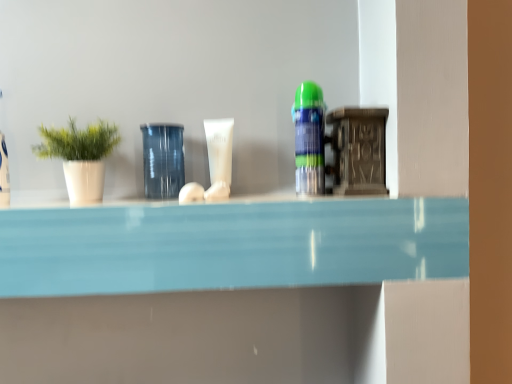
I want to click on white matte tube at center, the 1th toiletry when ordered from left to right, so click(x=219, y=157).

What do you see at coordinates (163, 160) in the screenshot?
I see `transparent glass jar at center` at bounding box center [163, 160].

Find the location of a particular element. white matte tube at center, the first toiletry positioned from the back is located at coordinates (219, 157).

Considering the relative positions of translucent plastic spray can at center, which appears as the first toiletry when viewed from the right, and white matte pot at left in the image provided, is translucent plastic spray can at center, which appears as the first toiletry when viewed from the right, to the left of white matte pot at left from the viewer's perspective?

No, translucent plastic spray can at center, which appears as the first toiletry when viewed from the right, is not to the left of white matte pot at left.

Considering the relative sizes of translucent plastic spray can at center, which appears as the second toiletry when viewed from the left, and white matte pot at left in the image provided, is translucent plastic spray can at center, which appears as the second toiletry when viewed from the left, thinner than white matte pot at left?

Indeed, translucent plastic spray can at center, which appears as the second toiletry when viewed from the left, has a lesser width compared to white matte pot at left.

Starting from the white matte pot at left, which toiletry is the 2nd one to the right? Please provide its 2D coordinates.

[(309, 138)]

Are white matte pot at left and white matte tube at center, arranged as the 2th toiletry when viewed from the front, far apart?

No.

Looking at the image, does white matte pot at left seem bigger or smaller compared to white matte tube at center, the 1th toiletry when ordered from left to right?

Clearly, white matte pot at left is larger in size than white matte tube at center, the 1th toiletry when ordered from left to right.

From the image's perspective, is white matte pot at left located beneath white matte tube at center, arranged as the 2th toiletry when viewed from the right?

Yes, from the image's perspective, white matte pot at left is below white matte tube at center, arranged as the 2th toiletry when viewed from the right.

Consider the image. Measure the distance from white matte pot at left to white matte tube at center, the 1th toiletry when ordered from left to right.

A distance of 8.90 inches exists between white matte pot at left and white matte tube at center, the 1th toiletry when ordered from left to right.

Can white matte pot at left be found inside white matte tube at center, arranged as the 2th toiletry when viewed from the front?

No, white matte pot at left is located outside of white matte tube at center, arranged as the 2th toiletry when viewed from the front.

Based on their positions, is white matte tube at center, arranged as the 2th toiletry when viewed from the front, located to the left or right of white matte pot at left?

Based on their positions, white matte tube at center, arranged as the 2th toiletry when viewed from the front, is located to the right of white matte pot at left.

Between white matte tube at center, arranged as the 2th toiletry when viewed from the right, and white matte pot at left, which one has smaller width?

With smaller width is white matte tube at center, arranged as the 2th toiletry when viewed from the right.

Looking at this image, is white matte tube at center, the 1th toiletry when ordered from left to right, aimed at white matte pot at left?

No, white matte tube at center, the 1th toiletry when ordered from left to right, is not aimed at white matte pot at left.

In the scene shown: Can we say white matte tube at center, arranged as the 2th toiletry when viewed from the front, lies outside transparent glass jar at center?

That's correct, white matte tube at center, arranged as the 2th toiletry when viewed from the front, is outside of transparent glass jar at center.

Is white matte tube at center, arranged as the 2th toiletry when viewed from the right, oriented away from transparent glass jar at center?

No.

Locate an element on the screen. Image resolution: width=512 pixels, height=384 pixels. glass vase to the left of white matte tube at center, arranged as the 2th toiletry when viewed from the front is located at coordinates (163, 160).

From a real-world perspective, is white matte tube at center, arranged as the 2th toiletry when viewed from the right, above or below transparent glass jar at center?

From a real-world perspective, white matte tube at center, arranged as the 2th toiletry when viewed from the right, is physically above transparent glass jar at center.

Is transparent glass jar at center far away from white matte tube at center, arranged as the 2th toiletry when viewed from the right?

They are positioned close to each other.

From the image's perspective, is transparent glass jar at center above or below white matte tube at center, arranged as the 2th toiletry when viewed from the front?

transparent glass jar at center is situated lower than white matte tube at center, arranged as the 2th toiletry when viewed from the front, in the image.

How different are the orientations of transparent glass jar at center and white matte tube at center, arranged as the 2th toiletry when viewed from the right, in degrees?

There is a 0.00773-degree angle between the facing directions of transparent glass jar at center and white matte tube at center, arranged as the 2th toiletry when viewed from the right.

Does transparent glass jar at center come in front of white matte tube at center, arranged as the 2th toiletry when viewed from the right?

Yes, transparent glass jar at center is in front of white matte tube at center, arranged as the 2th toiletry when viewed from the right.

Could you tell me if white matte pot at left is turned towards translucent plastic spray can at center, which appears as the first toiletry when viewed from the right?

No.

Is white matte pot at left to the left of translucent plastic spray can at center, which appears as the second toiletry when viewed from the left, from the viewer's perspective?

Yes.

From the image's perspective, between white matte pot at left and translucent plastic spray can at center, which appears as the second toiletry when viewed from the left, which one is located above?

From the image's view, translucent plastic spray can at center, which appears as the second toiletry when viewed from the left, is above.

Considering the sizes of objects white matte pot at left and translucent plastic spray can at center, the 2th toiletry viewed from the back, in the image provided, who is bigger, white matte pot at left or translucent plastic spray can at center, the 2th toiletry viewed from the back,?

With larger size is white matte pot at left.

Which object is closer to the camera, transparent glass jar at center or white matte pot at left?

Positioned in front is white matte pot at left.

From a real-world perspective, between transparent glass jar at center and white matte pot at left, who is vertically higher?

In real-world perspective, white matte pot at left is above.

Considering the relative sizes of transparent glass jar at center and white matte pot at left in the image provided, is transparent glass jar at center bigger than white matte pot at left?

Incorrect, transparent glass jar at center is not larger than white matte pot at left.

Is transparent glass jar at center aimed at white matte pot at left?

No, transparent glass jar at center does not turn towards white matte pot at left.

Starting from the white matte pot at left, which toiletry is the 1st one behind? Please provide its 2D coordinates.

[(309, 138)]

There is a white matte pot at left. Find the location of `the 1st toiletry above it (from the image's perspective)`. the 1st toiletry above it (from the image's perspective) is located at coordinates (219, 157).

Considering their positions, is white matte pot at left positioned further to white matte tube at center, the first toiletry positioned from the back, than translucent plastic spray can at center, marked as the first toiletry in a front-to-back arrangement?

white matte pot at left is positioned further to the anchor white matte tube at center, the first toiletry positioned from the back.

Which object lies further to the anchor point white matte tube at center, the first toiletry positioned from the back, translucent plastic spray can at center, which appears as the second toiletry when viewed from the left, or transparent glass jar at center?

translucent plastic spray can at center, which appears as the second toiletry when viewed from the left, is positioned further to the anchor white matte tube at center, the first toiletry positioned from the back.

Which object lies further to the anchor point white matte pot at left, transparent glass jar at center or white matte tube at center, the first toiletry positioned from the back?

white matte tube at center, the first toiletry positioned from the back.

Considering their positions, is white matte pot at left positioned closer to transparent glass jar at center than translucent plastic spray can at center, marked as the first toiletry in a front-to-back arrangement?

white matte pot at left lies closer to transparent glass jar at center than the other object.

Consider the image. When comparing their distances from translucent plastic spray can at center, which appears as the first toiletry when viewed from the right, does white matte tube at center, the first toiletry positioned from the back, or white matte pot at left seem further?

Among the two, white matte pot at left is located further to translucent plastic spray can at center, which appears as the first toiletry when viewed from the right.

From the image, which object appears to be nearer to white matte tube at center, arranged as the 2th toiletry when viewed from the front, transparent glass jar at center or translucent plastic spray can at center, marked as the first toiletry in a front-to-back arrangement?

transparent glass jar at center lies closer to white matte tube at center, arranged as the 2th toiletry when viewed from the front, than the other object.

Looking at the image, which one is located closer to white matte pot at left, white matte tube at center, arranged as the 2th toiletry when viewed from the front, or translucent plastic spray can at center, the 2th toiletry viewed from the back?

white matte tube at center, arranged as the 2th toiletry when viewed from the front, lies closer to white matte pot at left than the other object.

When comparing their distances from transparent glass jar at center, does white matte pot at left or white matte tube at center, arranged as the 2th toiletry when viewed from the front, seem closer?

Among the two, white matte tube at center, arranged as the 2th toiletry when viewed from the front, is located nearer to transparent glass jar at center.

Where is `glass vase situated between white matte pot at left and translucent plastic spray can at center, which appears as the first toiletry when viewed from the right, from left to right`? This screenshot has height=384, width=512. glass vase situated between white matte pot at left and translucent plastic spray can at center, which appears as the first toiletry when viewed from the right, from left to right is located at coordinates 163,160.

Identify the location of glass vase between white matte pot at left and white matte tube at center, the first toiletry positioned from the back. (163, 160).

Locate an element on the screen. toiletry situated between white matte pot at left and translucent plastic spray can at center, marked as the first toiletry in a front-to-back arrangement, from left to right is located at coordinates (219, 157).

The width and height of the screenshot is (512, 384). In order to click on toiletry located between transparent glass jar at center and translucent plastic spray can at center, the 2th toiletry viewed from the back, in the left-right direction in this screenshot , I will do `click(219, 157)`.